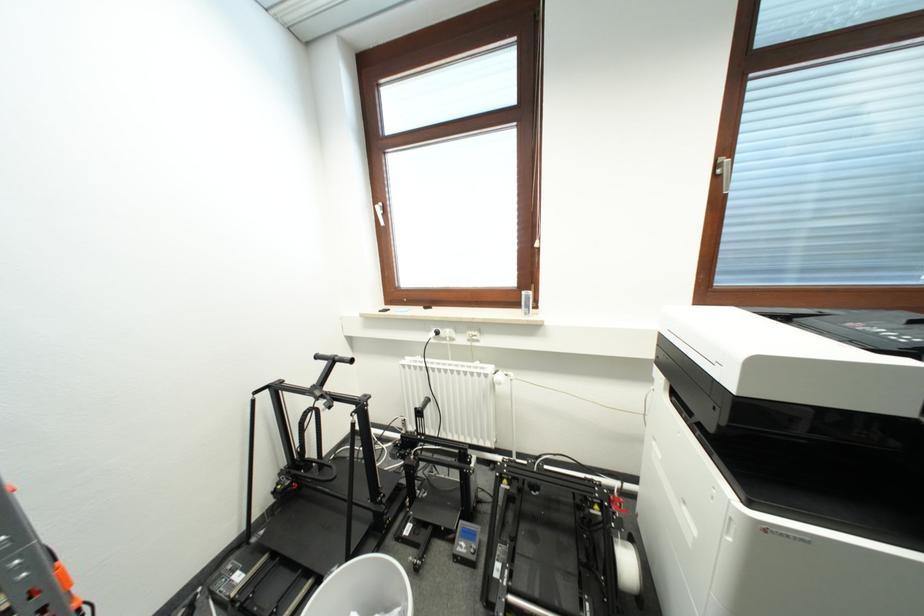
At what (x,y) coordinates should I click in order to perform the action: click on black T-shaped handle. Please return your answer as a coordinate pair (x, y). The image size is (924, 616). Looking at the image, I should click on (334, 359).